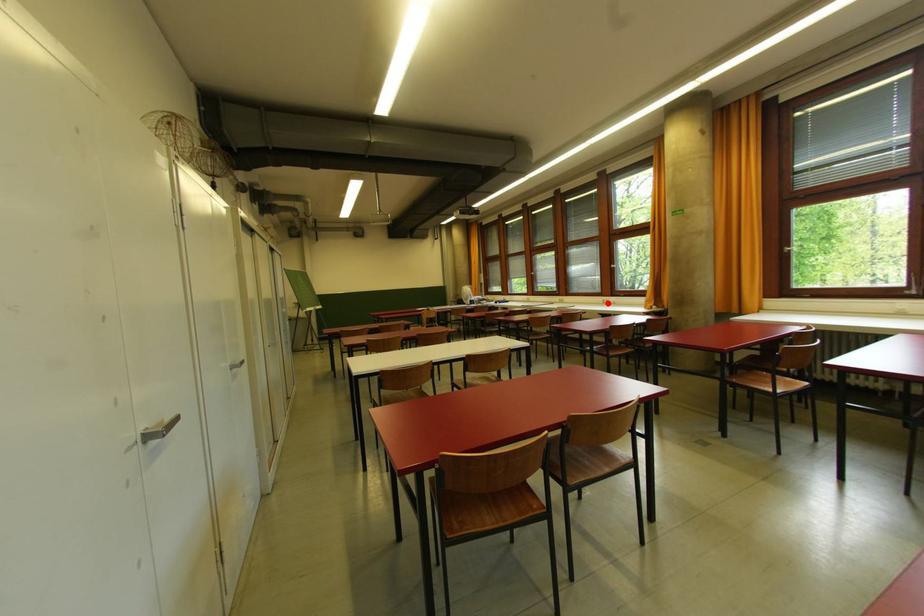
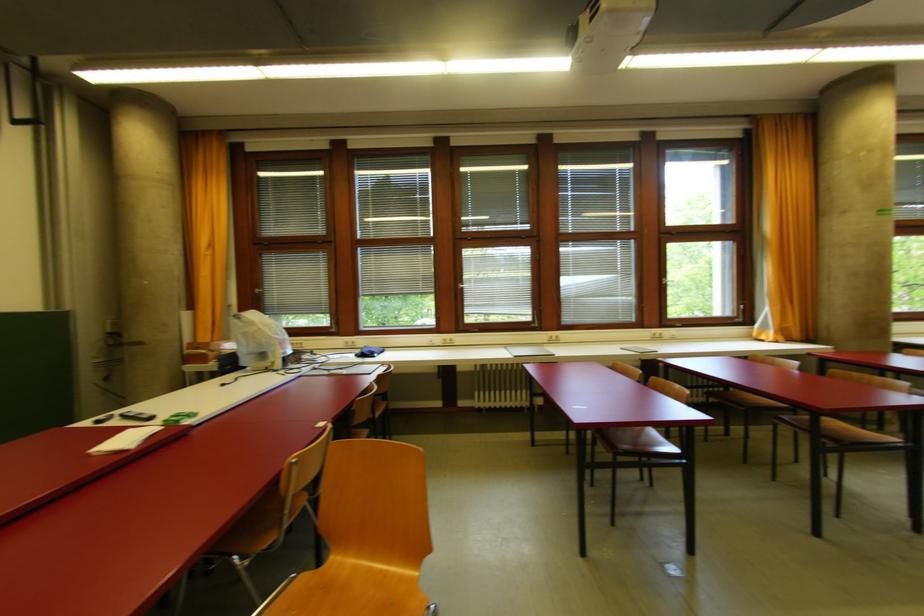
Question: I am providing you with two images of the same scene from different viewpoints. Given a red point in image1, look at the same physical point in image2. Is it:

Choices:
 (A) Closer to the viewpoint
 (B) Farther from the viewpoint

Answer: (B)